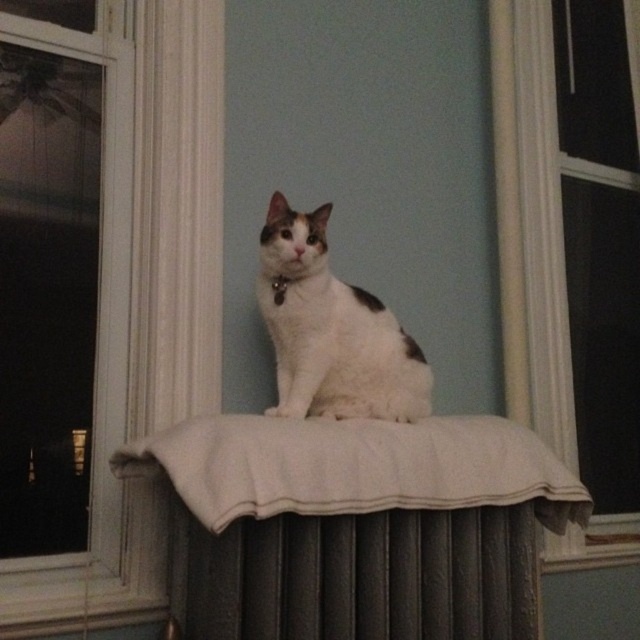
Question: Which of these objects is positioned farthest from the black fabric neckband at center?

Choices:
 (A) transparent glass window at upper left
 (B) white fur cat at center

Answer: (A)

Question: Can you confirm if transparent glass window at upper left is thinner than matte white frame at upper right?

Choices:
 (A) yes
 (B) no

Answer: (A)

Question: Is the position of white fur cat at center less distant than that of black fabric neckband at center?

Choices:
 (A) no
 (B) yes

Answer: (B)

Question: Which point appears farthest from the camera in this image?

Choices:
 (A) (284, 292)
 (B) (84, 474)
 (C) (508, 273)

Answer: (C)

Question: From the image, what is the correct spatial relationship of transparent glass window at upper left in relation to dark gray metal radiator at center?

Choices:
 (A) below
 (B) above

Answer: (B)

Question: Which of the following is the closest to the observer?

Choices:
 (A) (314, 292)
 (B) (301, 609)
 (C) (278, 304)
 (D) (56, 627)

Answer: (B)